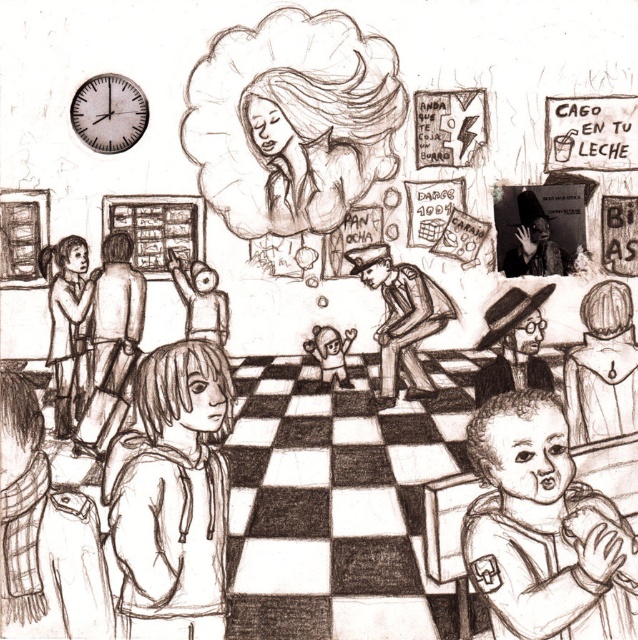
From the picture: You are a photographer standing in the middle of the scene. You want to take a photo of the smooth hoodie at center and the smooth brown uniform at center. Which one should you zoom in on more to make them appear the same size in the photo?

The smooth hoodie at center is taller than the smooth brown uniform at center, so you should zoom in more on the smooth hoodie at center to make them appear the same size in the photo.

You are standing in the center of the scene and want to place a new object at the exact center of the image. Where should you place it relative to the smooth brown uniform at center?

The exact center of the image is at point coordinates (319, 320). The smooth brown uniform at center is located at (401, 316), so to place the new object at the exact center, you should move it slightly upward and to the right from the smooth brown uniform at center.

You are a photographer positioned at the entrance of the scene. You want to take a photo of both the smooth hoodie at center and the smooth brown uniform at center. Which one will appear larger in your photo?

The smooth hoodie at center will appear larger in the photo because it is closer to the viewer than the smooth brown uniform at center.